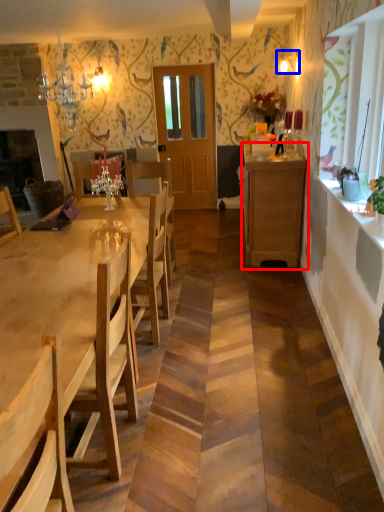
Question: Which point is closer to the camera, cabinetry (highlighted by a red box) or lamp (highlighted by a blue box)?

Choices:
 (A) cabinetry
 (B) lamp

Answer: (A)